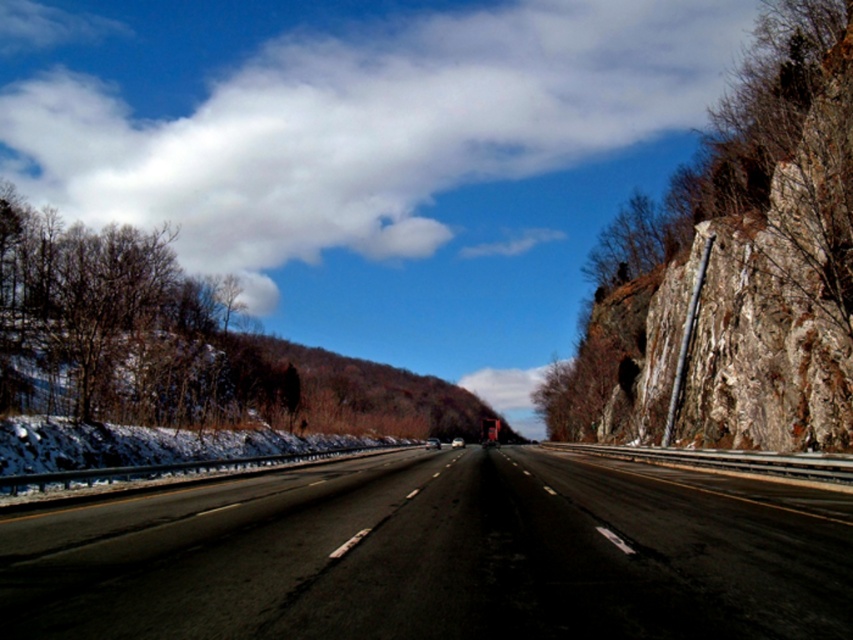
Question: Which point is closer to the camera?

Choices:
 (A) bare wood trees at left
 (B) black asphalt highway at center

Answer: (B)

Question: Observing the image, what is the correct spatial positioning of black asphalt highway at center in reference to bare wood trees at left?

Choices:
 (A) below
 (B) above

Answer: (A)

Question: Can you confirm if black asphalt highway at center is thinner than bare wood trees at left?

Choices:
 (A) yes
 (B) no

Answer: (A)

Question: Which point is closer to the camera?

Choices:
 (A) (274, 406)
 (B) (592, 605)

Answer: (B)

Question: Does black asphalt highway at center have a smaller size compared to bare wood trees at left?

Choices:
 (A) no
 (B) yes

Answer: (B)